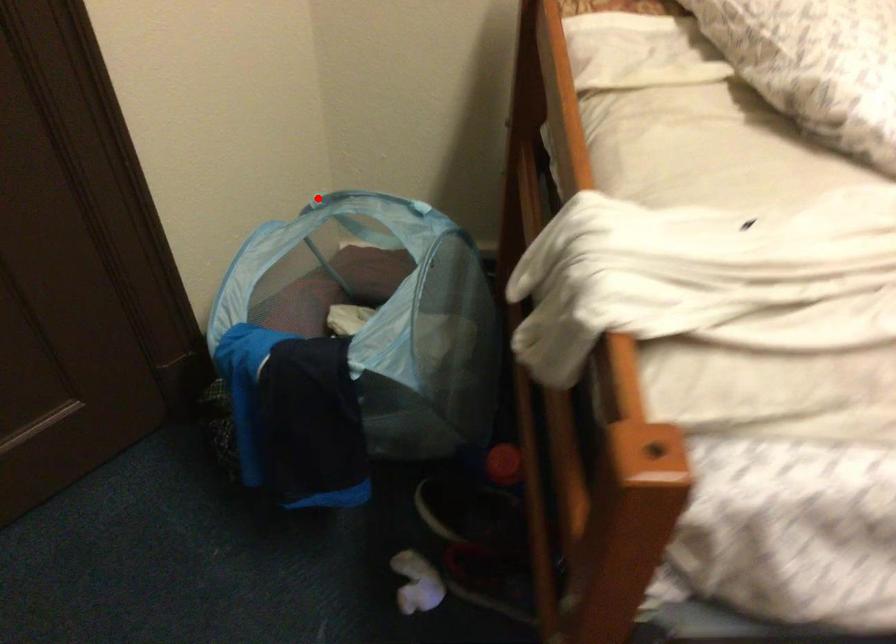
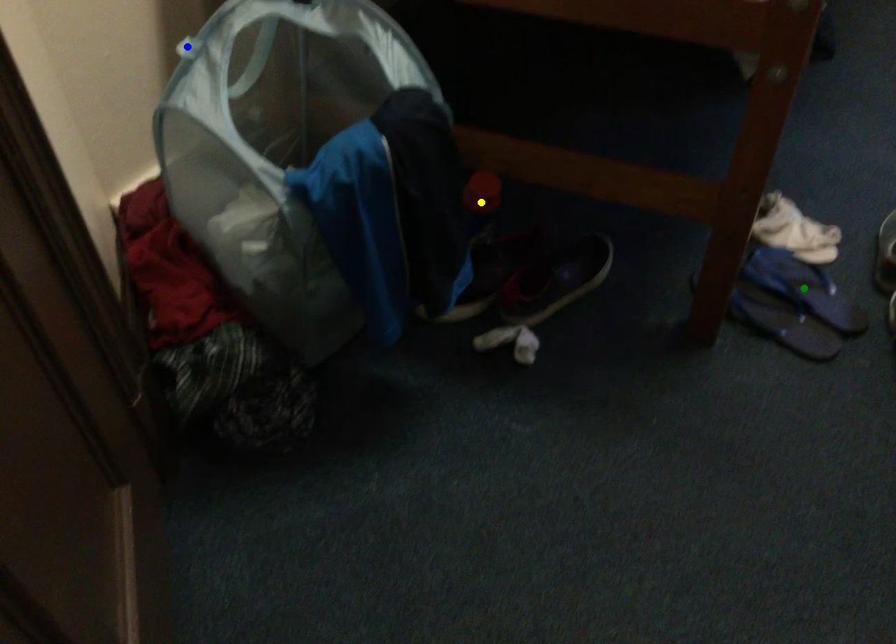
Question: I am providing you with two images of the same scene from different viewpoints. A red point is marked on the first image. You are given multiple points on the second image. In image 2, which mark is for the same physical point as the one in image 1?

Choices:
 (A) yellow point
 (B) green point
 (C) blue point

Answer: (C)